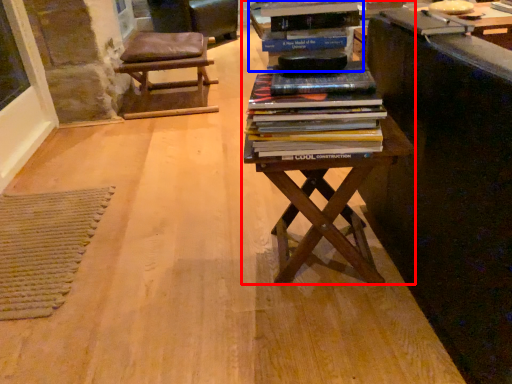
Question: Among these objects, which one is nearest to the camera, table (highlighted by a red box) or shelf (highlighted by a blue box)?

Choices:
 (A) table
 (B) shelf

Answer: (A)